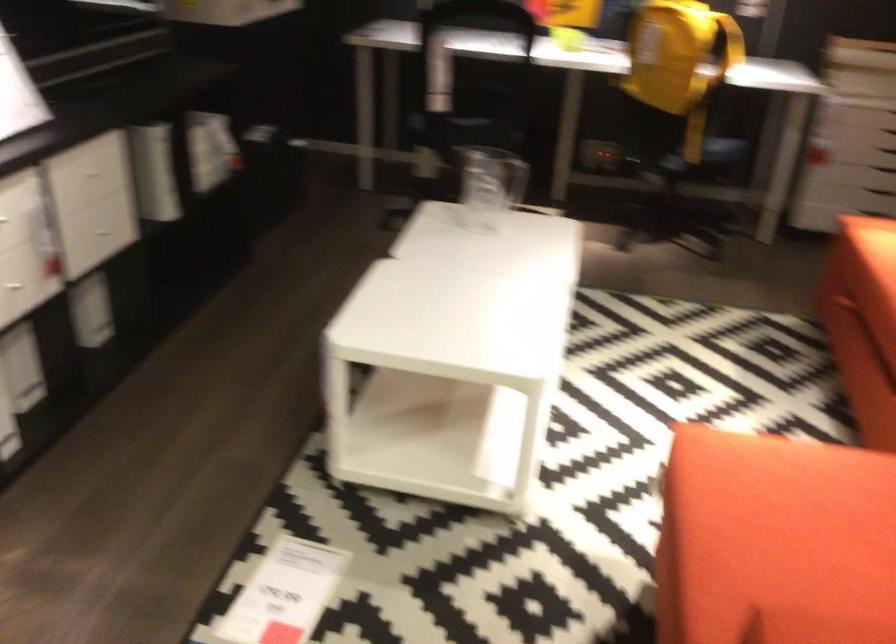
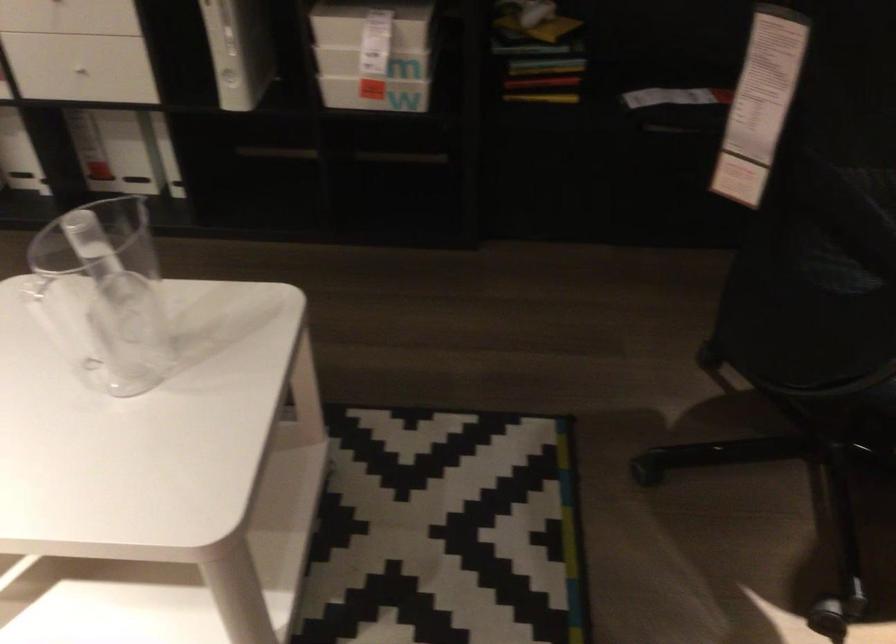
Locate, in the second image, the point that corresponds to the point at 500,134 in the first image.

(837, 364)